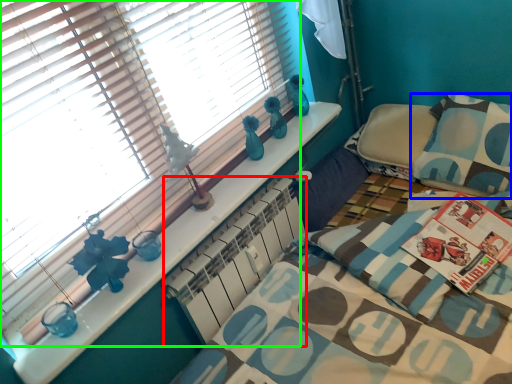
Question: Based on their relative distances, which object is farther from radiator (highlighted by a red box)? Choose from pillow (highlighted by a blue box) and window blind (highlighted by a green box).

Choices:
 (A) pillow
 (B) window blind

Answer: (A)